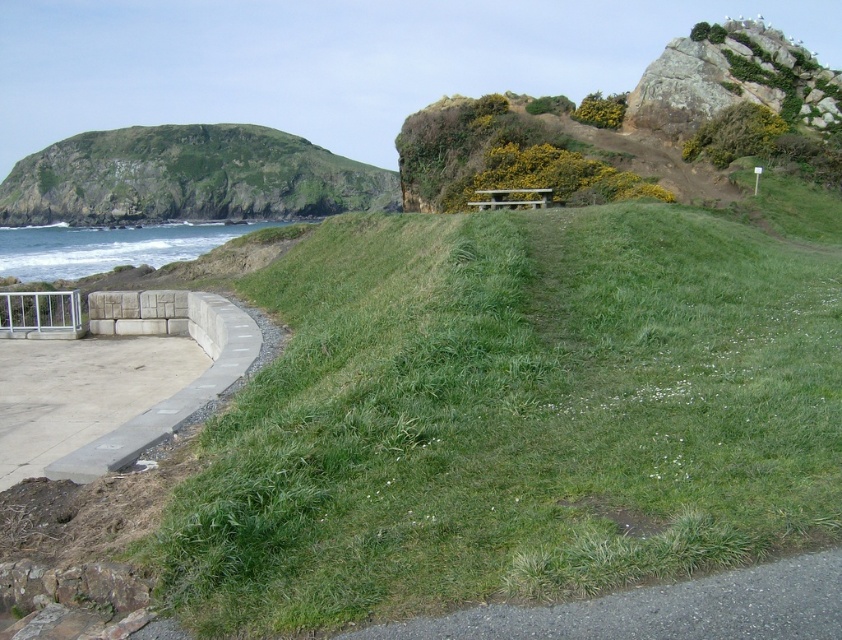
You are planning to set up a tent for a small gathering. Given the green grassy hill at center and the gray asphalt path at lower right, which location would provide more space for your group?

The green grassy hill at center has a greater width than the gray asphalt path at lower right, so it would provide more space for your group.

You are standing at the point labeled point (188, 177) in the image. What is the terrain like at your current location?

The terrain at point (188, 177) is a green grassy hillside at left.